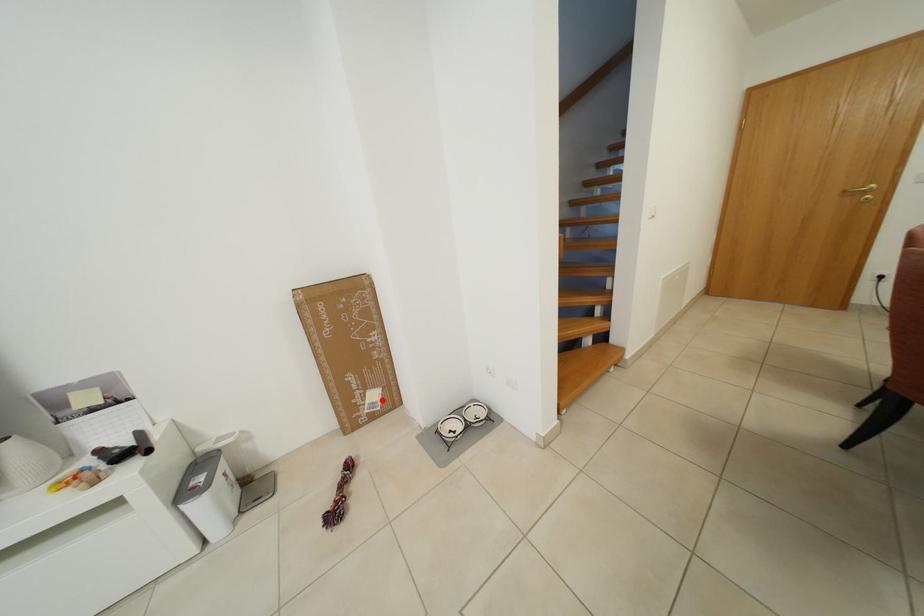
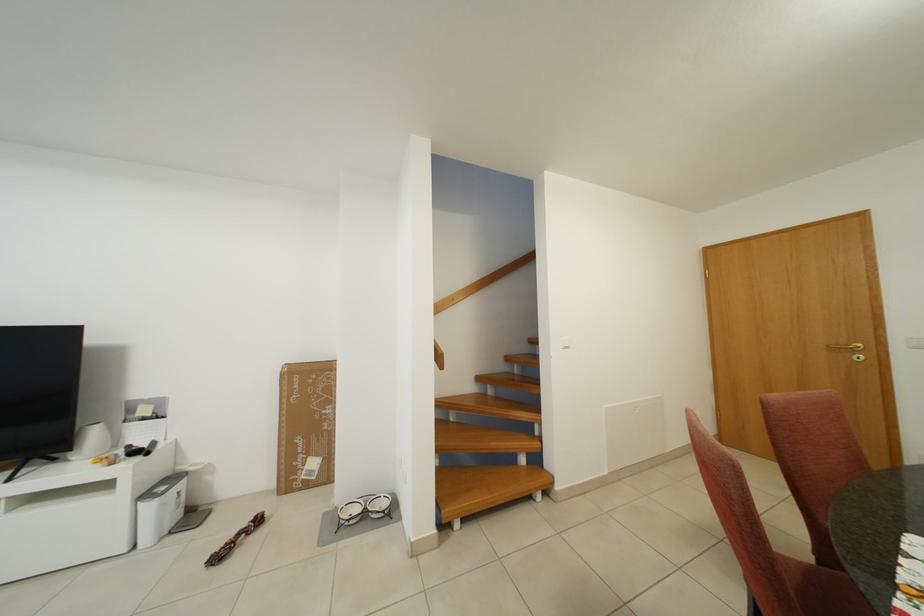
In the second image, find the point that corresponds to the highlighted location in the first image.

(322, 468)